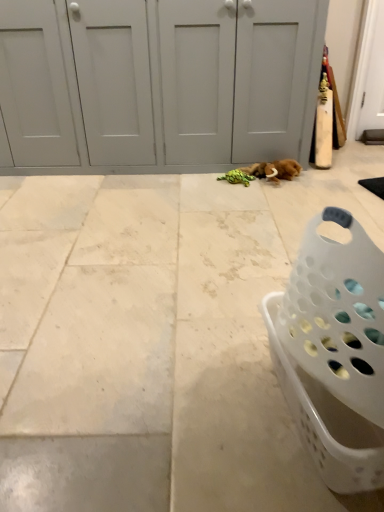
Where is `free space between white matte door at center and white plastic laundry basket at lower right`? The height and width of the screenshot is (512, 384). free space between white matte door at center and white plastic laundry basket at lower right is located at coordinates (168, 230).